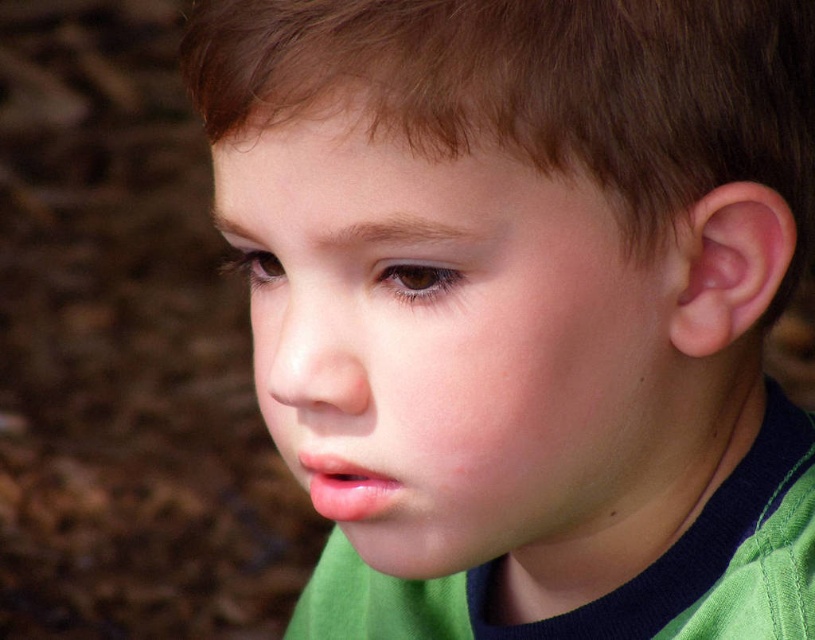
Question: Which point is farther to the camera?

Choices:
 (A) (285, 83)
 (B) (598, 422)

Answer: (B)

Question: Does smooth skin face at center appear on the right side of brown matte hair at upper center?

Choices:
 (A) no
 (B) yes

Answer: (A)

Question: Does smooth skin face at center lie behind brown matte hair at upper center?

Choices:
 (A) yes
 (B) no

Answer: (A)

Question: Is smooth skin face at center smaller than brown matte hair at upper center?

Choices:
 (A) no
 (B) yes

Answer: (A)